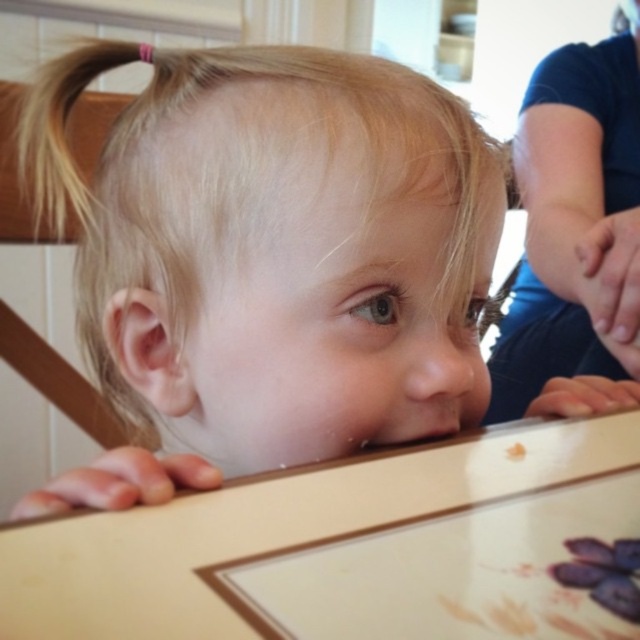
Question: From the image, what is the correct spatial relationship of wooden table at lower center in relation to blue denim jeans at upper right?

Choices:
 (A) left
 (B) right

Answer: (A)

Question: Among these points, which one is farthest from the camera?

Choices:
 (A) (604, 220)
 (B) (508, 621)
 (C) (611, 584)

Answer: (A)

Question: Which point is closer to the camera?

Choices:
 (A) blue denim jeans at upper right
 (B) wooden table at lower center
 (C) purple matte grapes at upper center

Answer: (B)

Question: Which point is closer to the camera?

Choices:
 (A) wooden table at lower center
 (B) purple matte grapes at upper center

Answer: (A)

Question: Is wooden table at lower center positioned before purple matte grapes at upper center?

Choices:
 (A) yes
 (B) no

Answer: (A)

Question: Is blue denim jeans at upper right smaller than purple matte grapes at upper center?

Choices:
 (A) no
 (B) yes

Answer: (A)